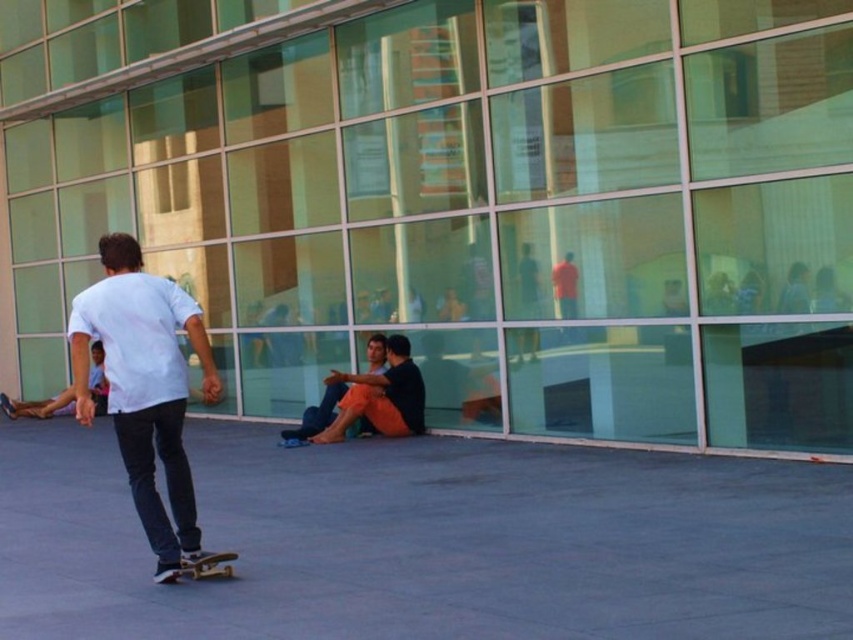
In the scene shown: You are standing in the urban scene and want to find the person wearing the orange cotton pants at center. Which direction should you look relative to the white matte shirt at center?

The white matte shirt at center is to the left of orange cotton pants at center, so you should look to the right of the white matte shirt at center to find the orange cotton pants at center.

You are a photographer standing at the edge of the gray concrete pavement at lower center and want to capture the wooden deck skateboard at lower center in your shot. Considering the height difference between them, will the skateboard be fully visible in the photo?

The gray concrete pavement at lower center is much taller than the wooden deck skateboard at lower center, so the skateboard might be partially obscured by the pavement in the photo.